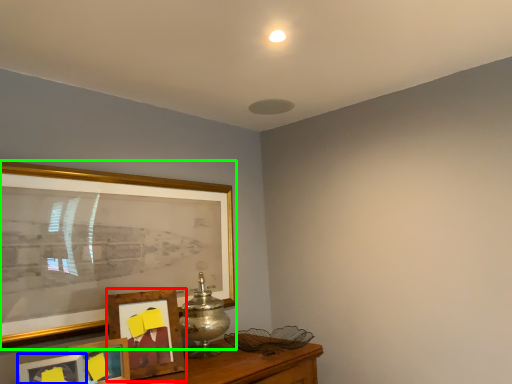
Question: Considering the real-world distances, which object is closest to picture frame (highlighted by a red box)? picture frame (highlighted by a blue box) or picture frame (highlighted by a green box).

Choices:
 (A) picture frame
 (B) picture frame

Answer: (A)